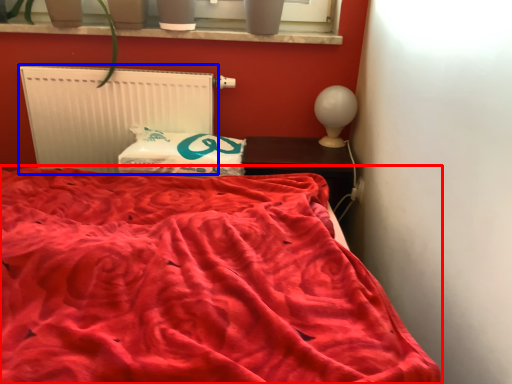
Question: Which point is further to the camera, bed (highlighted by a red box) or radiator (highlighted by a blue box)?

Choices:
 (A) bed
 (B) radiator

Answer: (B)